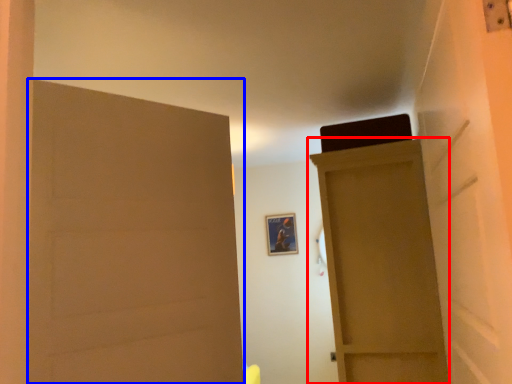
Question: Which of the following is the closest to the observer, door (highlighted by a red box) or door (highlighted by a blue box)?

Choices:
 (A) door
 (B) door

Answer: (B)